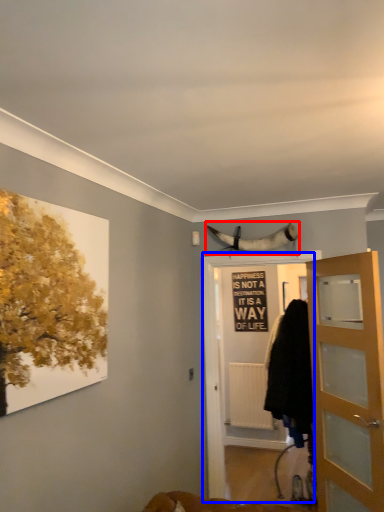
Question: Which point is closer to the camera, animal (highlighted by a red box) or screen door (highlighted by a blue box)?

Choices:
 (A) animal
 (B) screen door

Answer: (B)